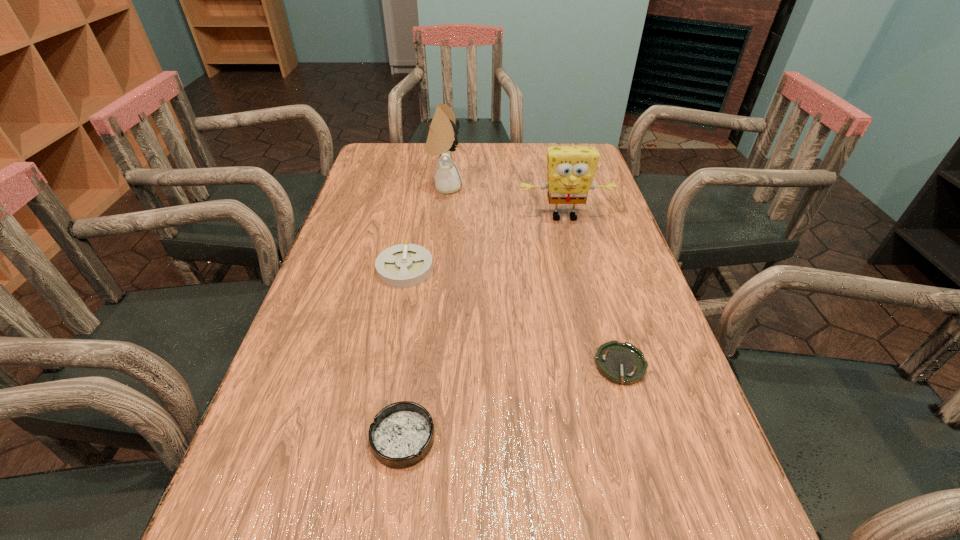
Locate an element on the screen. This screenshot has width=960, height=540. free space at the left edge is located at coordinates (355, 197).

This screenshot has width=960, height=540. In the image, there is a desktop. Identify the location of vacant space at the right edge. (687, 469).

Locate an element on the screen. The height and width of the screenshot is (540, 960). free space between the tallest object and the sponge is located at coordinates (505, 202).

I want to click on free space between the second nearest object and the second tallest object, so click(592, 292).

The image size is (960, 540). In order to click on free point between the farthest ashtray and the farthest object in this screenshot , I will do `click(425, 228)`.

The height and width of the screenshot is (540, 960). What are the coordinates of `empty space between the fourth farthest object and the second tallest object` in the screenshot? It's located at 592,292.

Locate an element on the screen. The width and height of the screenshot is (960, 540). unoccupied area between the shortest object and the nearest ashtray is located at coordinates (512, 402).

What are the coordinates of `empty space that is in between the farthest object and the shortest object` in the screenshot? It's located at (533, 276).

The image size is (960, 540). I want to click on unoccupied area between the nearest ashtray and the doll, so point(424,313).

What are the coordinates of `free area in between the farthest object and the second nearest ashtray` in the screenshot? It's located at (533, 276).